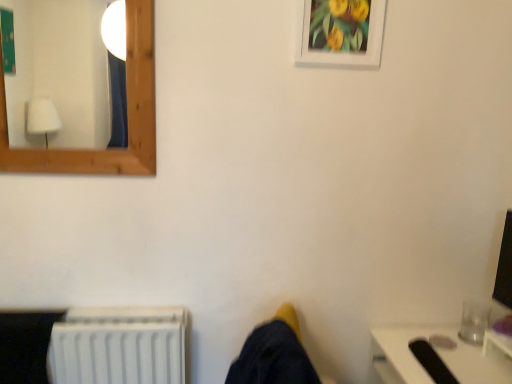
Question: From the image's perspective, is white matte picture frame at upper center above white plastic radiator at lower left?

Choices:
 (A) yes
 (B) no

Answer: (A)

Question: Can we say white matte picture frame at upper center lies outside white plastic radiator at lower left?

Choices:
 (A) no
 (B) yes

Answer: (B)

Question: Does white matte picture frame at upper center turn towards white plastic radiator at lower left?

Choices:
 (A) yes
 (B) no

Answer: (B)

Question: Does white matte picture frame at upper center have a greater width compared to white plastic radiator at lower left?

Choices:
 (A) yes
 (B) no

Answer: (B)

Question: Does white matte picture frame at upper center appear on the right side of white plastic radiator at lower left?

Choices:
 (A) no
 (B) yes

Answer: (B)

Question: Considering the relative sizes of white matte picture frame at upper center and white plastic radiator at lower left in the image provided, is white matte picture frame at upper center bigger than white plastic radiator at lower left?

Choices:
 (A) no
 (B) yes

Answer: (A)

Question: Is white plastic radiator at lower left further to camera compared to white matte picture frame at upper center?

Choices:
 (A) yes
 (B) no

Answer: (A)

Question: From a real-world perspective, is white plastic radiator at lower left physically below white matte picture frame at upper center?

Choices:
 (A) no
 (B) yes

Answer: (B)

Question: Is white matte picture frame at upper center at the back of white plastic radiator at lower left?

Choices:
 (A) no
 (B) yes

Answer: (A)

Question: Is white plastic radiator at lower left in contact with white matte picture frame at upper center?

Choices:
 (A) no
 (B) yes

Answer: (A)

Question: Is white plastic radiator at lower left not within white matte picture frame at upper center?

Choices:
 (A) yes
 (B) no

Answer: (A)

Question: Does white plastic radiator at lower left have a lesser width compared to white matte picture frame at upper center?

Choices:
 (A) no
 (B) yes

Answer: (A)

Question: Does white matte picture frame at upper center appear on the right side of wooden frame mirror at upper left?

Choices:
 (A) no
 (B) yes

Answer: (B)